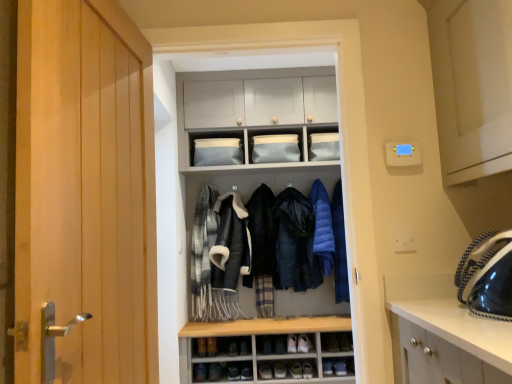
Question: Is dark blue down jacket at center, which is the 3th clothing in right-to-left order, taller or shorter than leather shoe at lower center, the 3th shoe positioned from the left?

Choices:
 (A) short
 (B) tall

Answer: (B)

Question: From the image's perspective, is dark blue down jacket at center, which is the 3th clothing in right-to-left order, located above or below leather shoe at lower center, the 3th shoe positioned from the left?

Choices:
 (A) above
 (B) below

Answer: (A)

Question: Based on their relative distances, which object is farther from the dark blue down jacket at center, placed as the third clothing when sorted from left to right?

Choices:
 (A) blue down jacket at center, arranged as the 2th clothing when viewed from the right
 (B) matte gray cabinet at upper center, which is the 1th cabinet in right-to-left order
 (C) matte blue fabric at upper center, the 1th cabinet in the left-to-right sequence
 (D) matte gray cabinet at center
 (E) brown leather shoe at lower center, the first shoe positioned from the left

Answer: (E)

Question: Estimate the real-world distances between objects in this image. Which object is farther from the plaid wool scarf at center, which is the 5th clothing from right to left?

Choices:
 (A) dark blue down jacket at center, which is the 3th clothing in right-to-left order
 (B) brown leather shoe at lower center, placed as the 3th shoe when sorted from bottom to top
 (C) blue down jacket at center, the 5th clothing when ordered from left to right
 (D) wooden door at left
 (E) white leather shoe at lower center, the 2th shoe when ordered from right to left

Answer: (D)